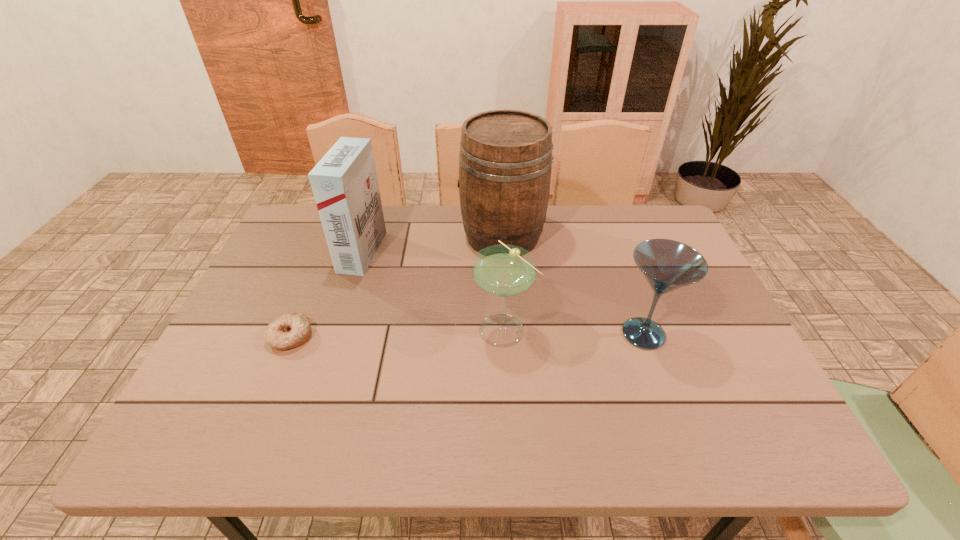
This screenshot has height=540, width=960. What are the coordinates of `free space that is in between the right martini and the left martini` in the screenshot? It's located at (574, 331).

You are a GUI agent. You are given a task and a screenshot of the screen. Output one action in this format:
    pyautogui.click(x=<x>, y=<y>)
    Task: Click on the object that is the closest to the cider
    The width and height of the screenshot is (960, 540).
    Given the screenshot: What is the action you would take?
    pyautogui.click(x=503, y=270)

The image size is (960, 540). Find the location of `object that is the third closest to the right martini`. object that is the third closest to the right martini is located at coordinates (344, 182).

The width and height of the screenshot is (960, 540). I want to click on blank area in the image that satisfies the following two spatial constraints: 1. on the back side of the doughnut; 2. on the right side of the cigarette case, so click(x=325, y=252).

You are a GUI agent. You are given a task and a screenshot of the screen. Output one action in this format:
    pyautogui.click(x=<x>, y=<y>)
    Task: Click on the vacant space that satisfies the following two spatial constraints: 1. on the side of the cider near the bung hole; 2. on the left side of the right martini
    
    Given the screenshot: What is the action you would take?
    pyautogui.click(x=508, y=334)